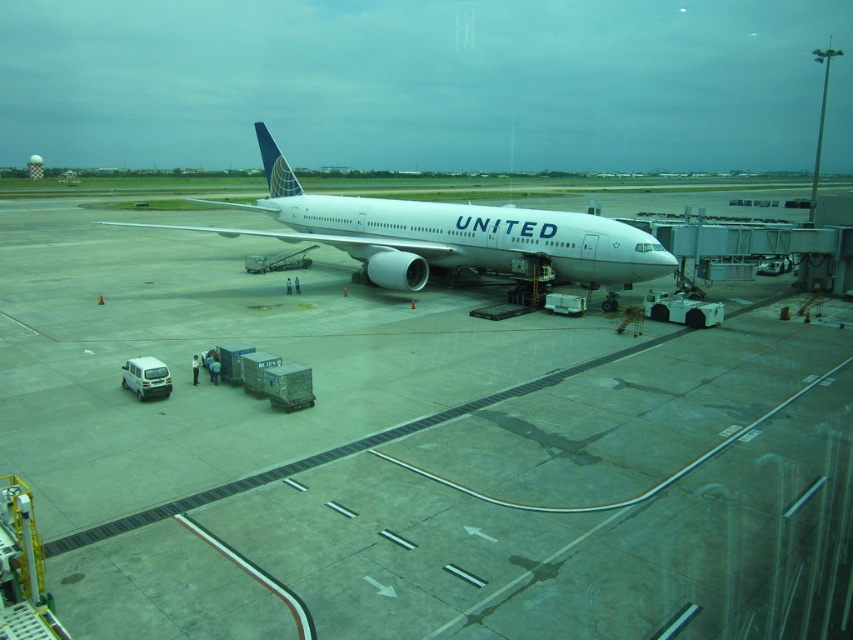
Which of these two, white smooth tarmac at center or white glossy airplane at center, stands shorter?

white smooth tarmac at center is shorter.

Is point (213, 260) positioned after point (631, 232)?

Yes, it is.

Is point (567, 326) positioned before point (444, 224)?

Yes, it is.

Locate an element on the screen. This screenshot has width=853, height=640. white smooth tarmac at center is located at coordinates (412, 454).